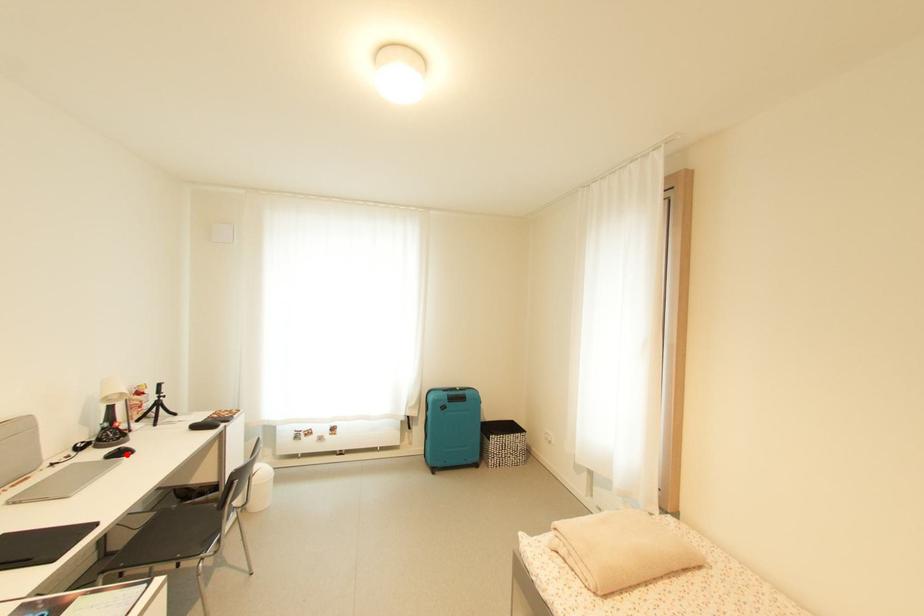
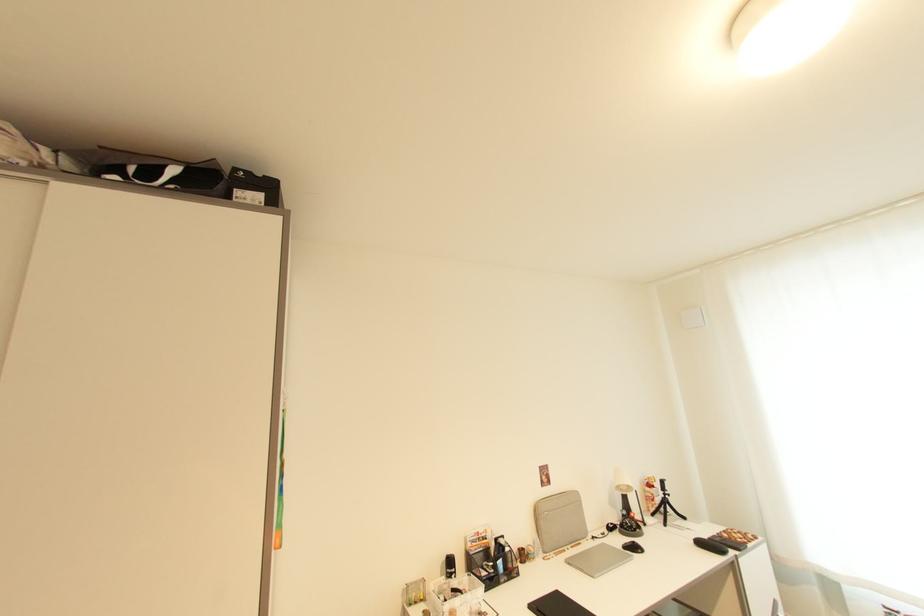
Where in the second image is the point corresponding to the highlighted location from the first image?

(639, 549)